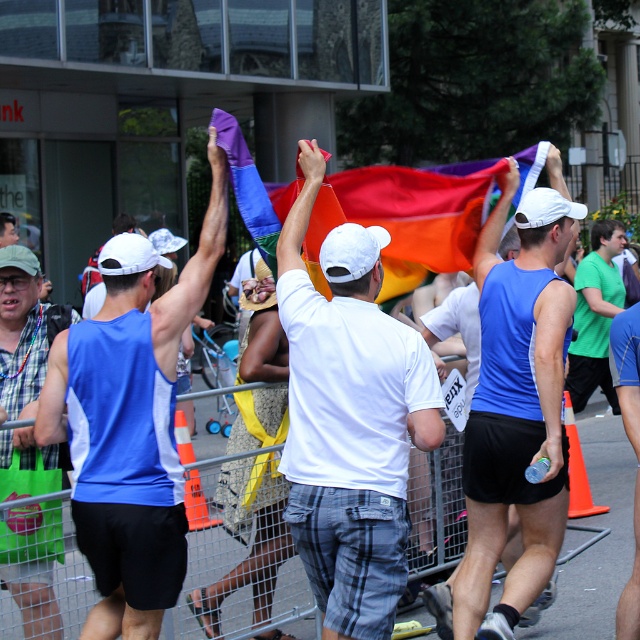
Question: Does blue sleeveless shirt at center appear on the right side of matte blue tank top at left?

Choices:
 (A) no
 (B) yes

Answer: (B)

Question: Which of these objects is positioned farthest from the blue fabric flag at center?

Choices:
 (A) green matte shirt at center
 (B) white cotton t-shirt at center
 (C) blue sleeveless shirt at center

Answer: (A)

Question: Can you confirm if blue fabric flag at center is positioned to the right of green matte shirt at center?

Choices:
 (A) yes
 (B) no

Answer: (B)

Question: Which object is closer to the camera taking this photo?

Choices:
 (A) blue sleeveless shirt at center
 (B) white cotton t-shirt at center
 (C) blue fabric flag at center

Answer: (B)

Question: Can you confirm if white cotton t-shirt at center is wider than matte blue tank top at left?

Choices:
 (A) yes
 (B) no

Answer: (A)

Question: Which object is the closest to the blue sleeveless shirt at center?

Choices:
 (A) blue fabric flag at center
 (B) matte blue tank top at left
 (C) white cotton t-shirt at center
 (D) green matte shirt at center

Answer: (B)